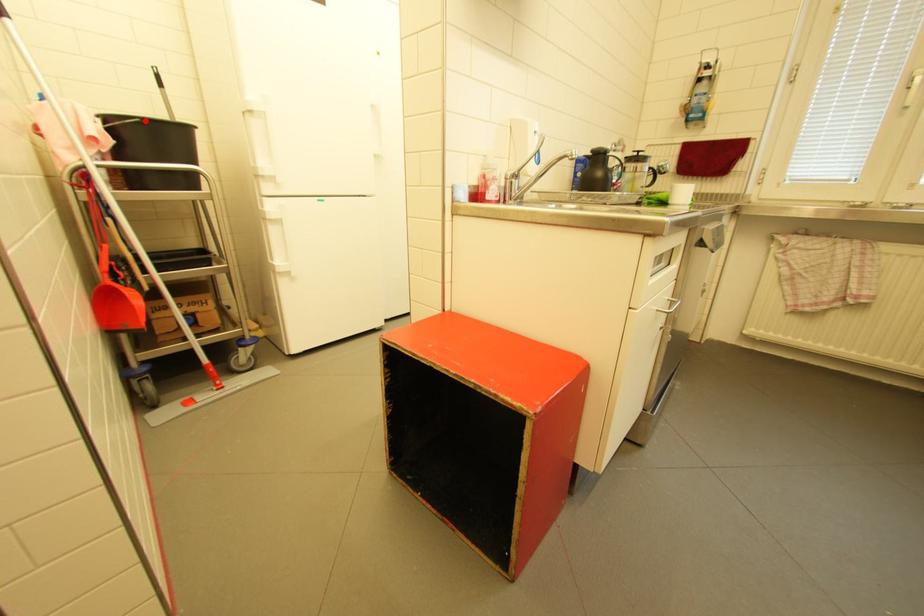
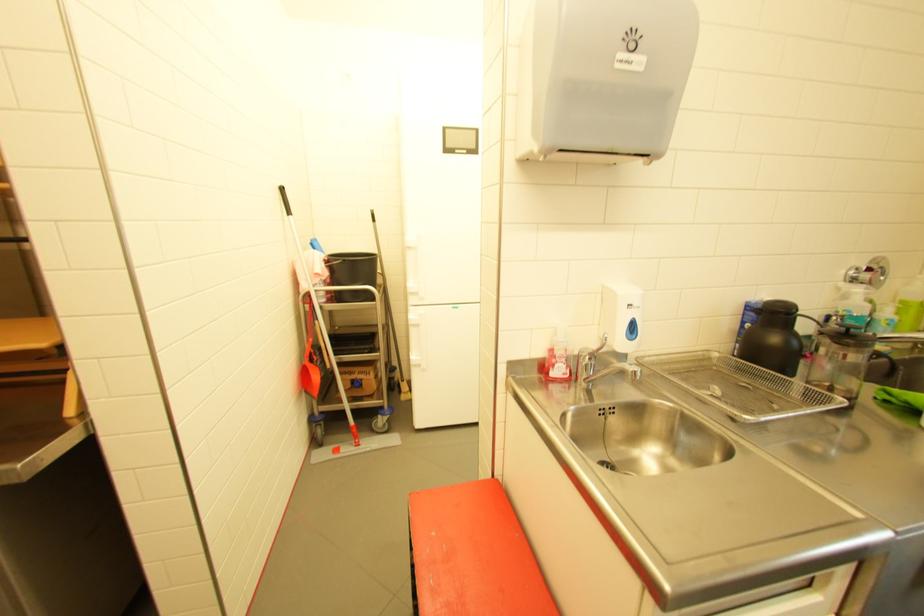
The point at the highlighted location is marked in the first image. Where is the corresponding point in the second image?

(347, 261)